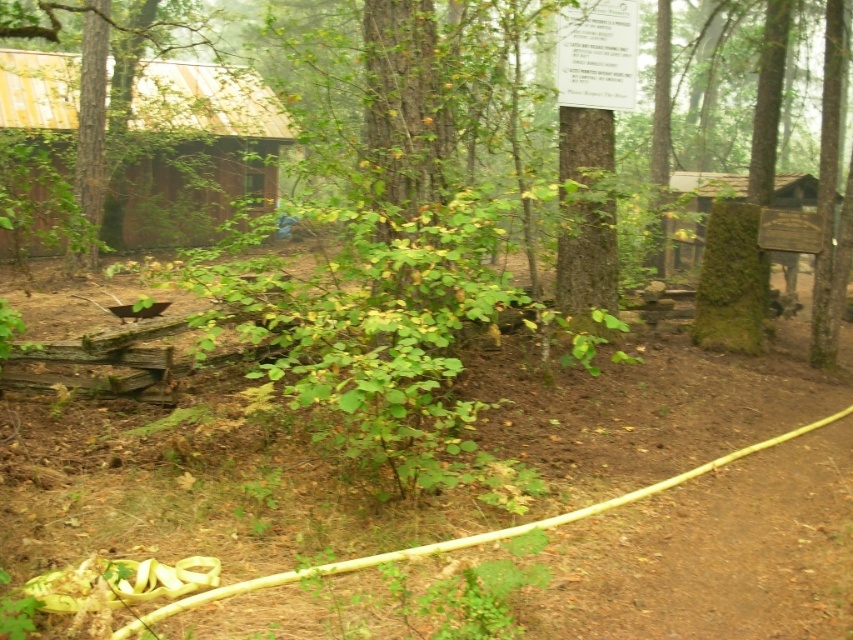
Question: Can you confirm if yellow rubber hose at lower center is thinner than green mossy sign at upper right?

Choices:
 (A) yes
 (B) no

Answer: (B)

Question: In this image, where is yellow rubber hose at lower center located relative to green mossy sign at upper right?

Choices:
 (A) right
 (B) left

Answer: (B)

Question: Which point appears farthest from the camera in this image?

Choices:
 (A) (233, 440)
 (B) (184, 120)
 (C) (676, 252)

Answer: (B)

Question: Which point is closer to the camera?

Choices:
 (A) green mossy sign at upper right
 (B) brown wooden cabin at left

Answer: (A)

Question: Considering the relative positions of yellow rubber hose at lower center and green mossy sign at upper right in the image provided, where is yellow rubber hose at lower center located with respect to green mossy sign at upper right?

Choices:
 (A) left
 (B) right

Answer: (A)

Question: Among these points, which one is farthest from the camera?

Choices:
 (A) (4, 84)
 (B) (627, 600)
 (C) (674, 188)

Answer: (C)